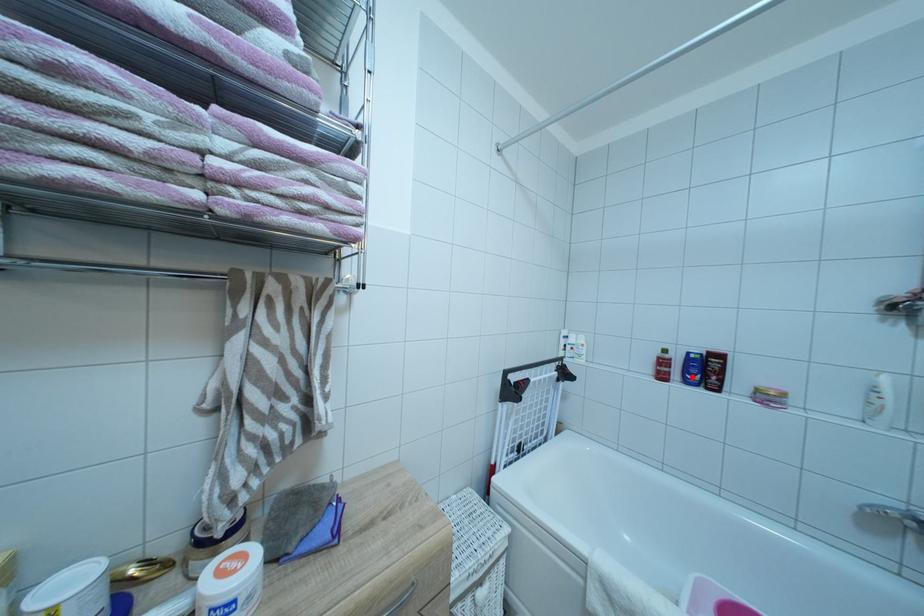
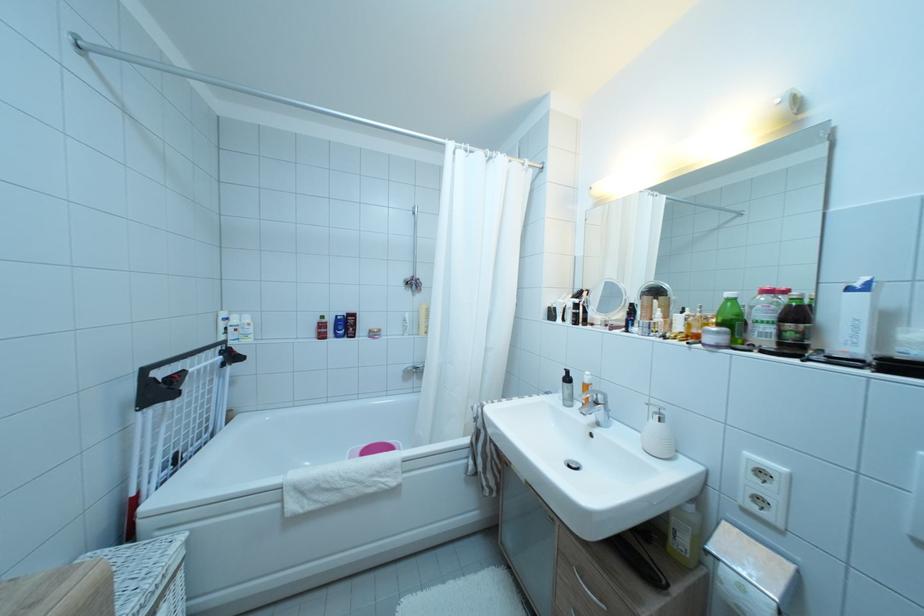
Question: I am providing you with two images of the same scene from different viewpoints. A red point is marked on the first image. Is the red point's position out of view in image 2?

Choices:
 (A) Yes
 (B) No

Answer: (B)